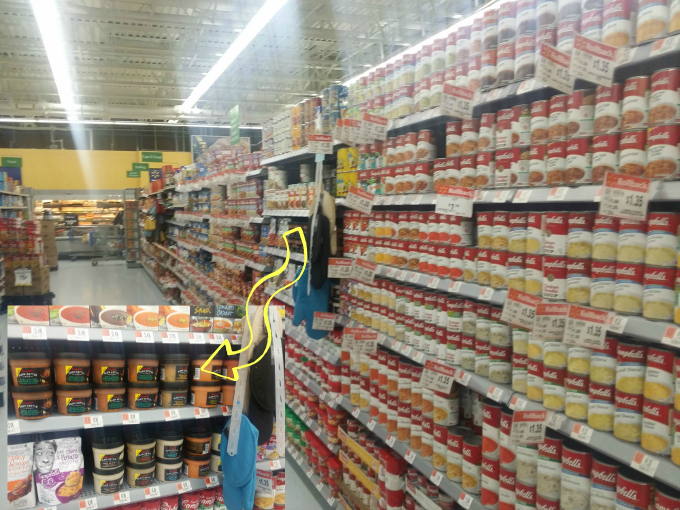
The height and width of the screenshot is (510, 680). I want to click on refrigerator, so click(88, 214).